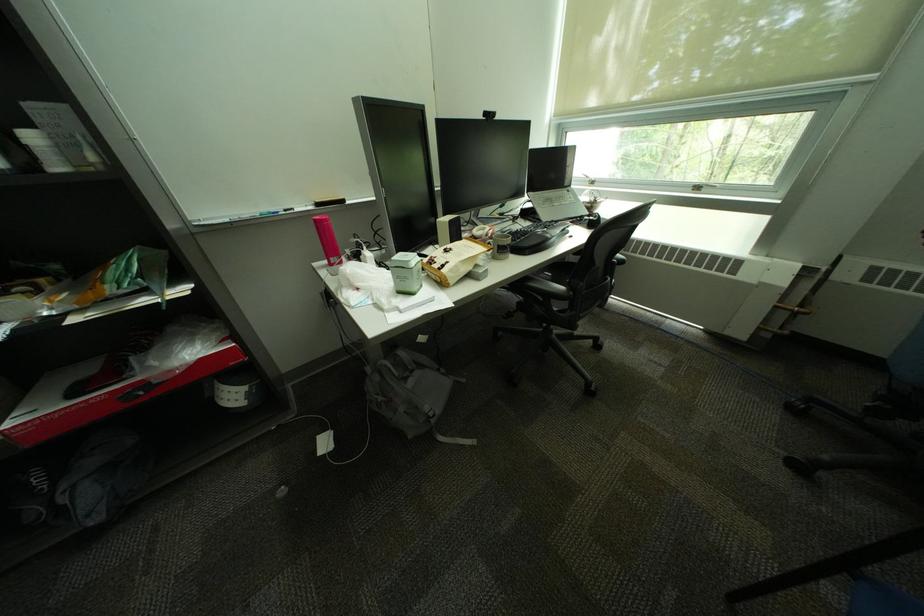
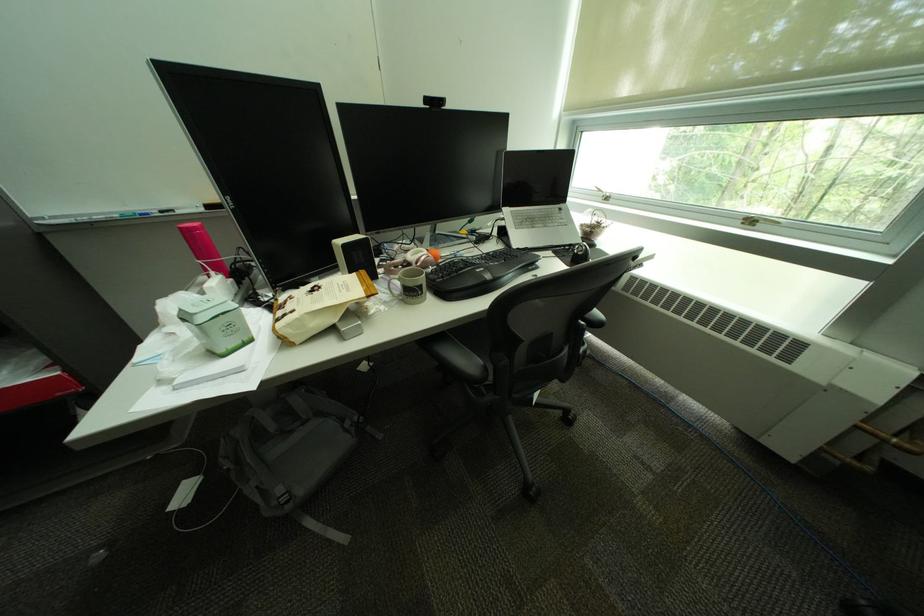
Find the pixel in the second image that matches the point at 520,232 in the first image.

(463, 261)